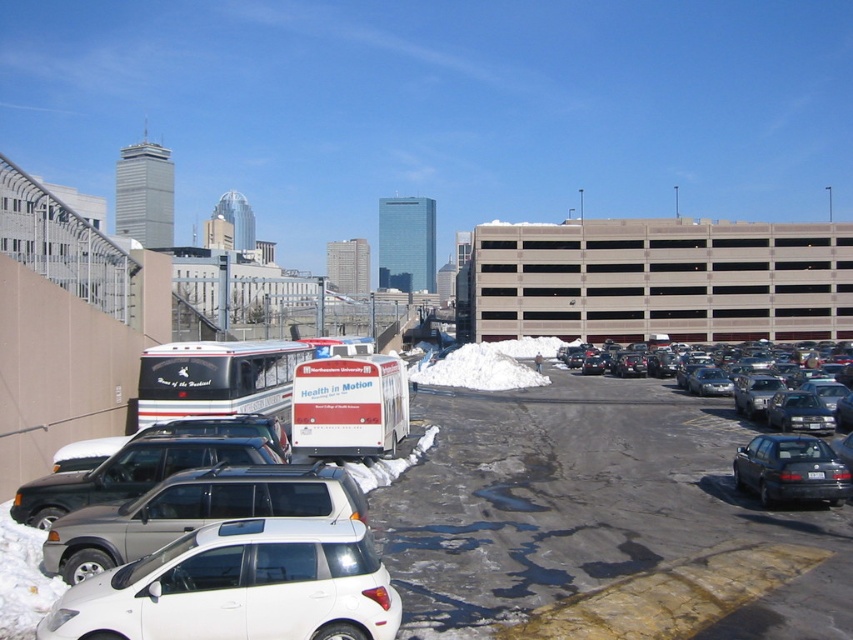
You are standing at the point with coordinates point (59,573) and want to walk to the point with coordinates point (737,470). Based on the scene description, will you have to walk towards the parking garage or away from it?

Since point (59,573) is in front of point (737,470), you are closer to the parking garage. To reach point (737,470), you would need to walk away from the parking garage.

You are standing at the entrance of the parking lot, which is located at coordinate point 0.000, 0.000. You need to drive to the white matte hatchback at center. What is the direction you should head towards from your current position?

The white matte hatchback at center is located at coordinate point (x=194, y=512). From your starting position at (x=0, y=0), you should head towards the northeast direction to reach it.

You are standing in the parking lot and want to take a photo of both the white matte hatchback at lower left and the black glossy sedan at center right. Which vehicle should you focus on first to ensure both are in the frame?

You should focus on the white matte hatchback at lower left first because it is closer to you than the black glossy sedan at center right, so adjusting the camera to include both would require framing starting from the closer one.